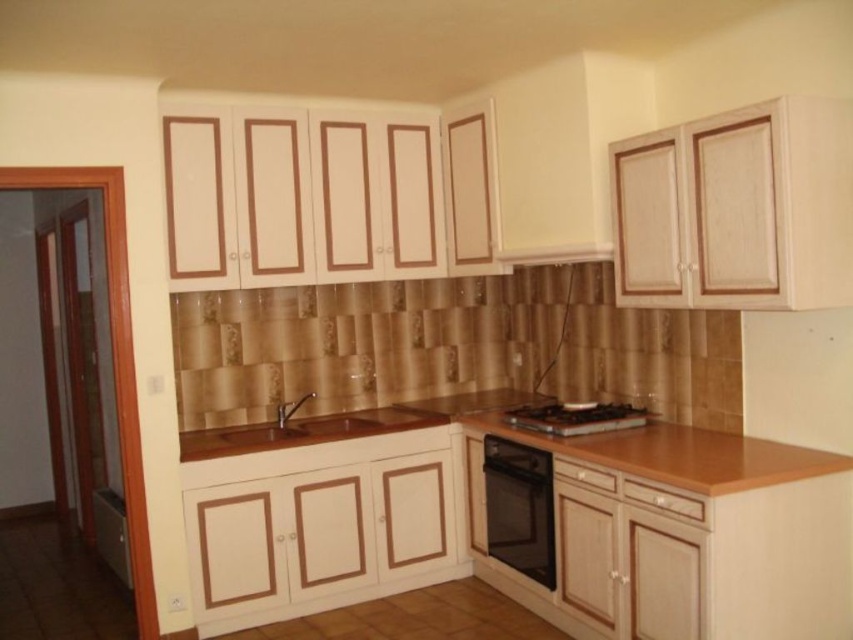
Question: Does wooden countertop at center appear under black glass gas stove at center?

Choices:
 (A) yes
 (B) no

Answer: (A)

Question: Which of the following is the farthest from the observer?

Choices:
 (A) black glass gas stove at center
 (B) matte wood sink at center

Answer: (B)

Question: Where is wooden at center located in relation to matte wood sink at center in the image?

Choices:
 (A) above
 (B) below

Answer: (A)

Question: Based on their relative distances, which object is farther from the black glass gas stove at center?

Choices:
 (A) wooden countertop at center
 (B) matte wood sink at center
 (C) wooden at center
 (D) black glass oven at lower right

Answer: (B)

Question: Can you confirm if black glass oven at lower right is smaller than black glass gas stove at center?

Choices:
 (A) yes
 (B) no

Answer: (B)

Question: Which object appears farthest from the camera in this image?

Choices:
 (A) black glass gas stove at center
 (B) matte wood sink at center

Answer: (B)